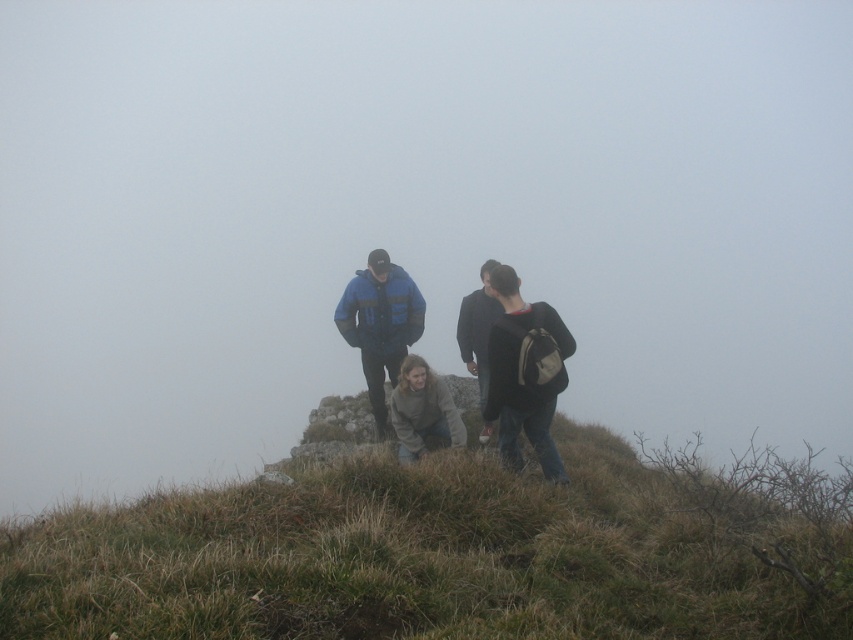
Question: Which point is farther to the camera?

Choices:
 (A) green grassy hillside at center
 (B) dark gray sweater at center
 (C) dark gray backpack at center

Answer: (B)

Question: Which object is the closest to the light brown sweater at center?

Choices:
 (A) dark gray backpack at center
 (B) green grassy hillside at center

Answer: (A)

Question: Considering the relative positions of green grassy hillside at center and dark gray backpack at center in the image provided, where is green grassy hillside at center located with respect to dark gray backpack at center?

Choices:
 (A) left
 (B) right

Answer: (A)

Question: Where is dark gray backpack at center located in relation to dark gray sweater at center in the image?

Choices:
 (A) left
 (B) right

Answer: (B)

Question: Among these objects, which one is nearest to the camera?

Choices:
 (A) light brown sweater at center
 (B) dark gray sweater at center

Answer: (A)

Question: Can you confirm if light brown sweater at center is wider than dark gray sweater at center?

Choices:
 (A) yes
 (B) no

Answer: (A)